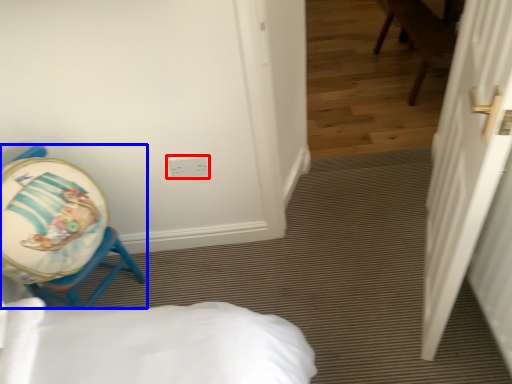
Question: Which point is further to the camera, electric outlet (highlighted by a red box) or chair (highlighted by a blue box)?

Choices:
 (A) electric outlet
 (B) chair

Answer: (A)